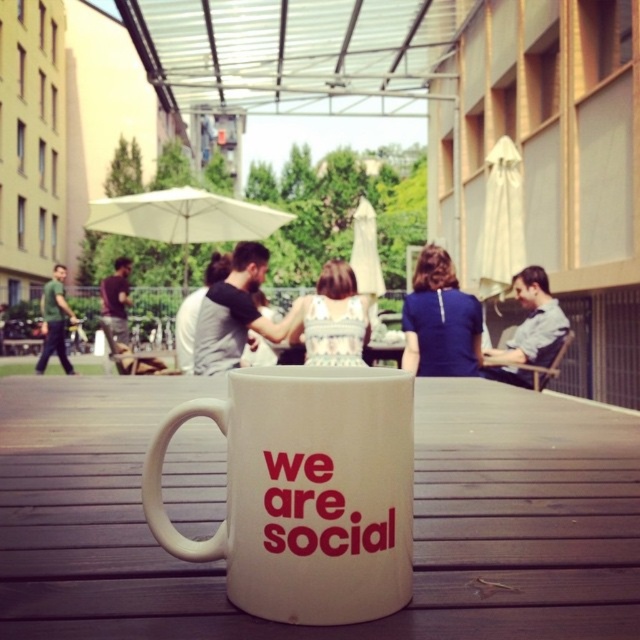
Who is taller, white wooden table at center or blue fabric shirt at center?

With more height is blue fabric shirt at center.

How distant is white wooden table at center from blue fabric shirt at center?

white wooden table at center is 2.48 meters away from blue fabric shirt at center.

Find the location of `white wooden table at center`. white wooden table at center is located at coordinates (413, 516).

Does white lace dress at center come in front of light blue shirt at center?

Yes, white lace dress at center is closer to the viewer.

Does point (330, 275) come behind point (544, 365)?

No, it is in front of (544, 365).

Does point (333, 307) lie behind point (557, 332)?

No, it is not.

Where is `white lace dress at center`? This screenshot has width=640, height=640. white lace dress at center is located at coordinates (332, 317).

Is white lace dress at center shorter than green cotton shirt at left?

Yes, white lace dress at center is shorter than green cotton shirt at left.

Locate an element on the screen. This screenshot has height=640, width=640. white lace dress at center is located at coordinates (332, 317).

I want to click on white lace dress at center, so click(332, 317).

The image size is (640, 640). Find the location of `white lace dress at center`. white lace dress at center is located at coordinates (332, 317).